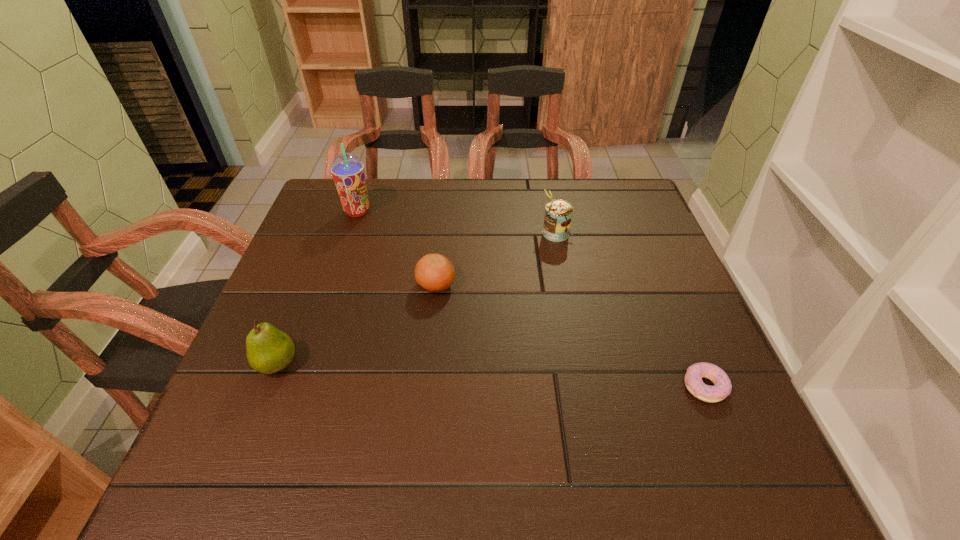
In order to click on free point located 0.160m on the back of the fourth nearest object in this screenshot , I will do `click(547, 190)`.

The width and height of the screenshot is (960, 540). In order to click on free region located 0.050m on the right of the pear in this screenshot , I will do `click(324, 364)`.

Locate an element on the screen. The height and width of the screenshot is (540, 960). vacant region located 0.270m on the left of the third nearest object is located at coordinates (301, 285).

This screenshot has width=960, height=540. What are the coordinates of `vacant space located on the back of the doughnut` in the screenshot? It's located at (679, 325).

In order to click on smoothie that is at the far edge in this screenshot , I will do `click(348, 172)`.

Identify the location of can present at the far edge. (558, 213).

Locate an element on the screen. smoothie present at the left edge is located at coordinates pyautogui.click(x=348, y=172).

The width and height of the screenshot is (960, 540). I want to click on pear that is positioned at the left edge, so click(269, 350).

The width and height of the screenshot is (960, 540). I want to click on object located at the right edge, so click(x=722, y=387).

Where is `object located at the far left corner`? Image resolution: width=960 pixels, height=540 pixels. object located at the far left corner is located at coordinates (348, 172).